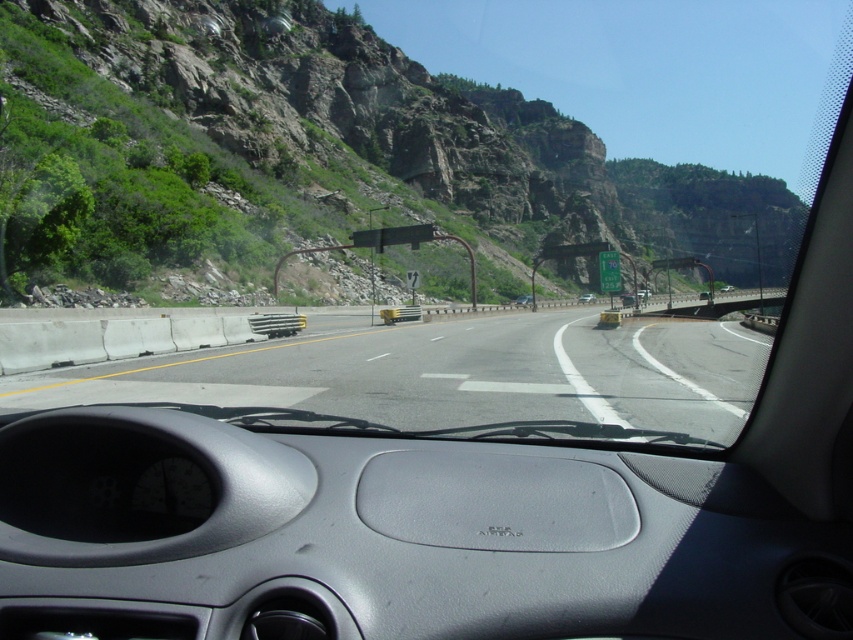
Question: Among these objects, which one is nearest to the camera?

Choices:
 (A) gray matte dashboard at center
 (B) green rocky hillside at upper left
 (C) metallic silver sedan at center

Answer: (A)

Question: Can you confirm if asphalt road at center is positioned above silver metallic sedan at center?

Choices:
 (A) yes
 (B) no

Answer: (B)

Question: Considering the relative positions of gray matte dashboard at center and silver metallic sedan at center in the image provided, where is gray matte dashboard at center located with respect to silver metallic sedan at center?

Choices:
 (A) left
 (B) right

Answer: (A)

Question: Is gray matte dashboard at center below asphalt road at center?

Choices:
 (A) yes
 (B) no

Answer: (A)

Question: Which of the following is the farthest from the observer?

Choices:
 (A) silver metallic sedan at center
 (B) asphalt road at center

Answer: (A)

Question: Considering the real-world distances, which object is closest to the silver metallic sedan at center?

Choices:
 (A) gray matte dashboard at center
 (B) metallic silver sedan at center
 (C) asphalt road at center
 (D) green rocky hillside at upper left

Answer: (B)